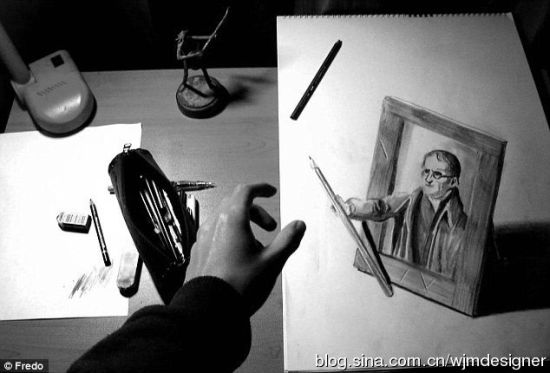
This screenshot has height=373, width=550. Identify the location of piece of paper. (28, 160).